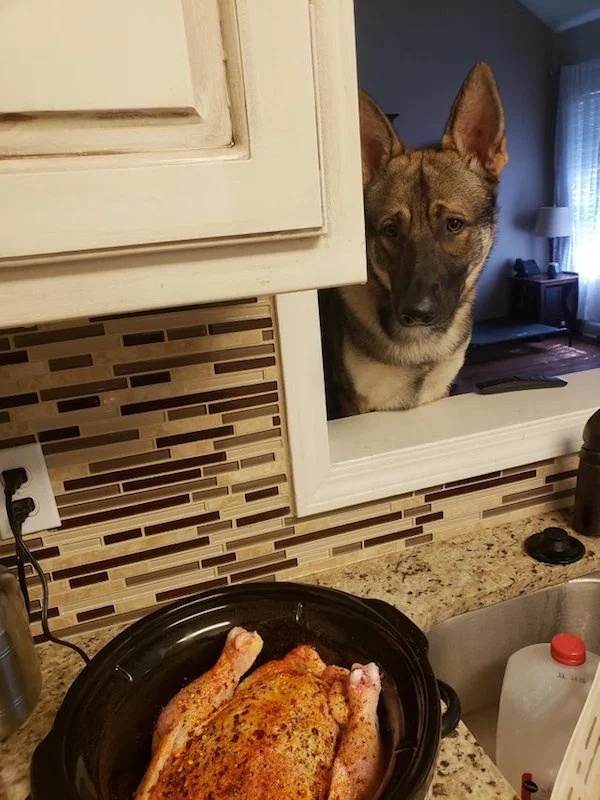
The image size is (600, 800). I want to click on crockpot, so click(x=85, y=714).